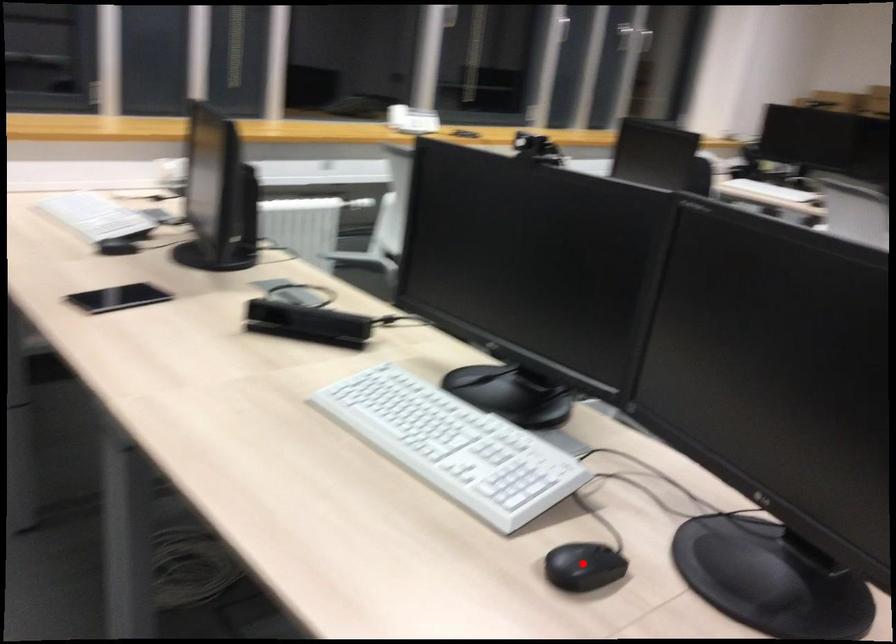
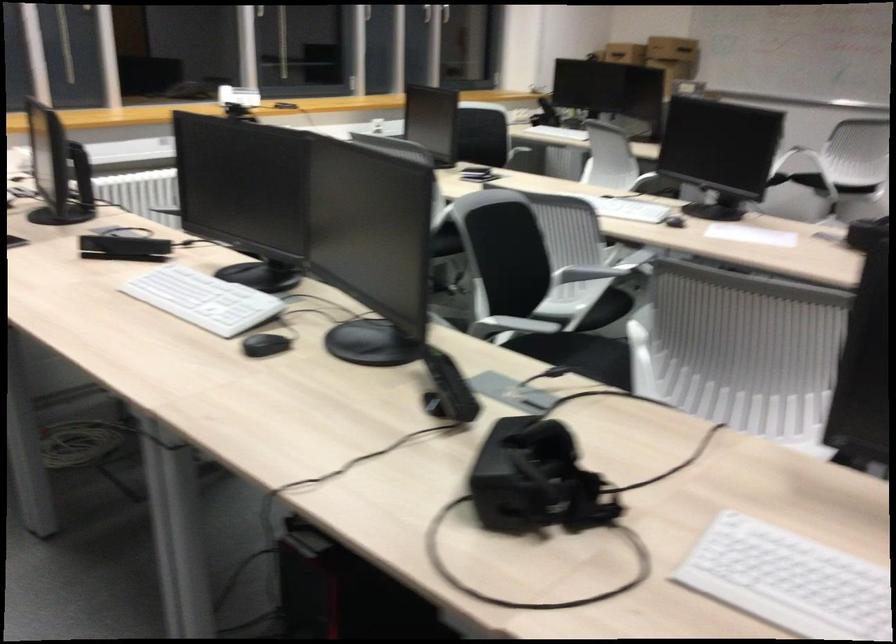
The point at the highlighted location is marked in the first image. Where is the corresponding point in the second image?

(264, 345)